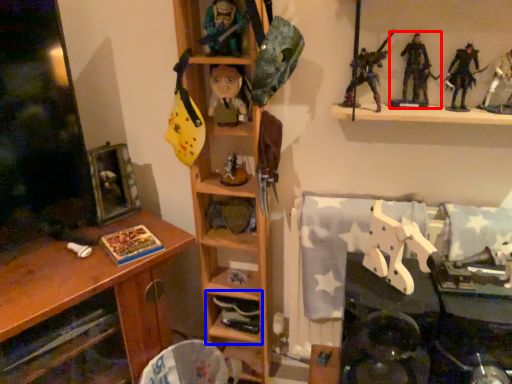
Question: Which object appears farthest to the camera in this image, toy (highlighted by a red box) or shelf (highlighted by a blue box)?

Choices:
 (A) toy
 (B) shelf

Answer: (B)